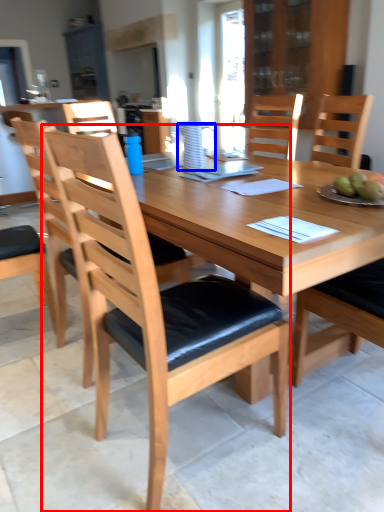
Question: Which object is further to the camera taking this photo, chair (highlighted by a red box) or pitcher (highlighted by a blue box)?

Choices:
 (A) chair
 (B) pitcher

Answer: (B)